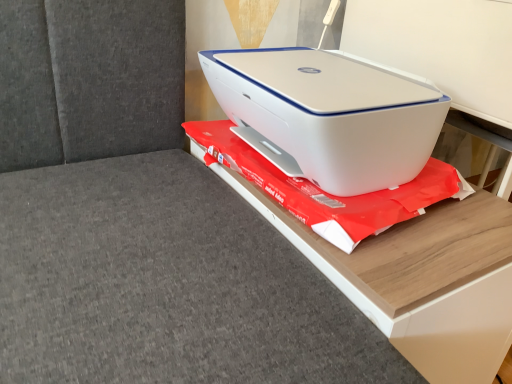
Where is `free space above white plastic printer at upper right (from a real-world perspective)`? free space above white plastic printer at upper right (from a real-world perspective) is located at coordinates (334, 67).